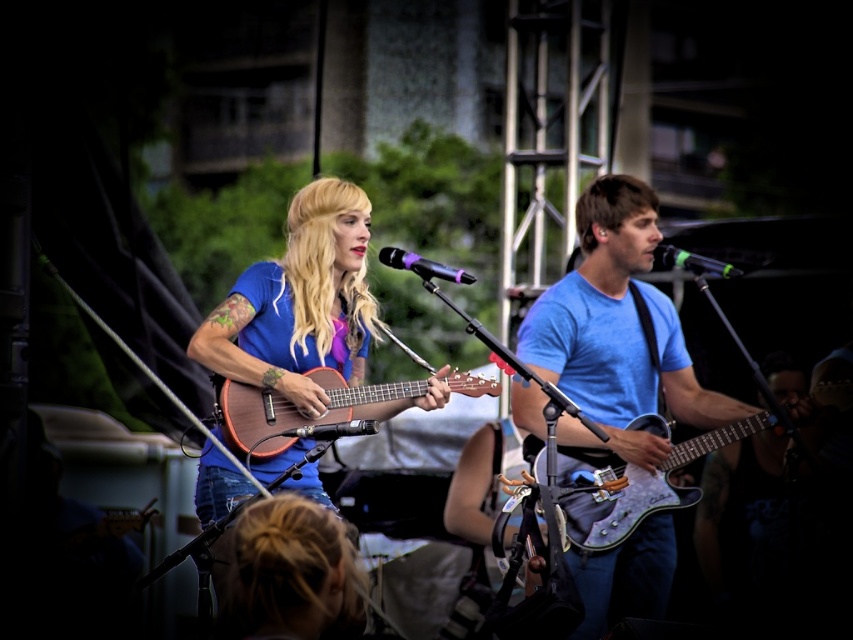
You are a sound engineer adjusting the microphones during the live performance. The purple matte microphone at center and the black metallic microphone at center are both in use. Which microphone is positioned closer to the audience?

The purple matte microphone at center is closer to the viewer than the black metallic microphone at center, so it is positioned closer to the audience.

You are a sound technician adjusting microphones for two performers on stage. The purple matte microphone at center is for the singer on the left and the black metallic microphone at center is for the singer on the right. Which microphone should you raise to ensure both singers have equal microphone heights?

The purple matte microphone at center is shorter than the black metallic microphone at center, so you should raise the purple matte microphone at center to match the height of the black metallic microphone at center.

What is the position of the point labeled as point (294, 410) in relation to the wooden acoustic guitar at center?

The point labeled as point (294, 410) is located on the wooden acoustic guitar at center.